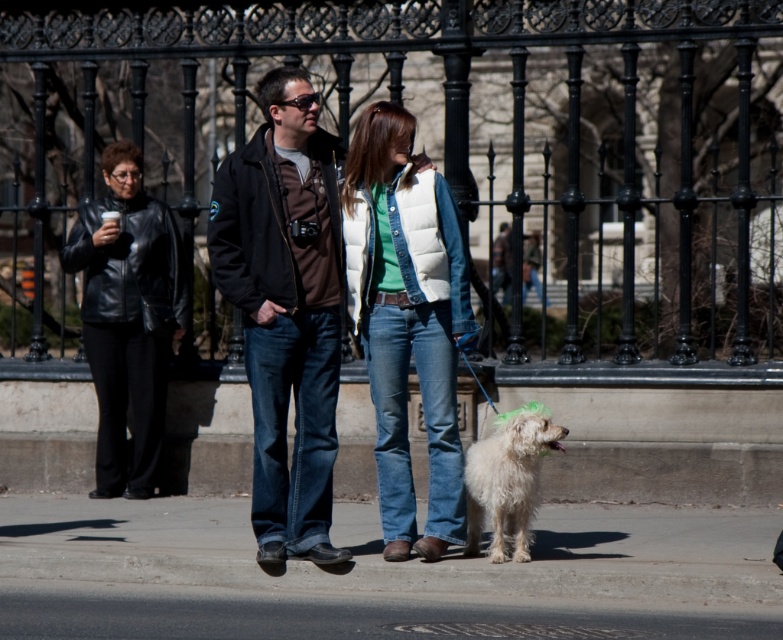
You are a delivery robot with a 16 inch wide package. You need to move from the gray concrete pavement at lower center to the white fluffy dog at lower right. Can you fit through the space between them?

The distance between the gray concrete pavement at lower center and the white fluffy dog at lower right is 17.73 inches. Since the package is 16 inches wide, it should fit through the space as 16 is less than 17.73.